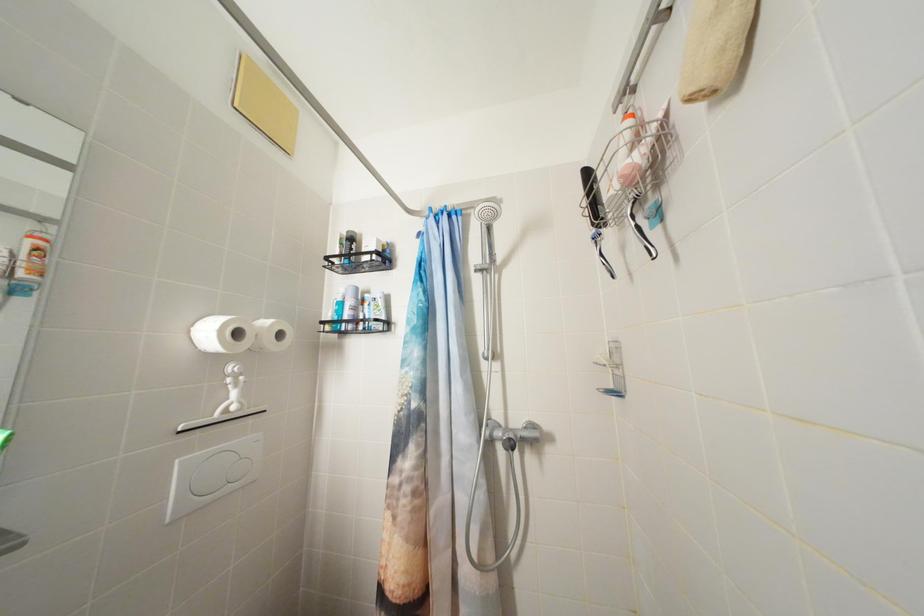
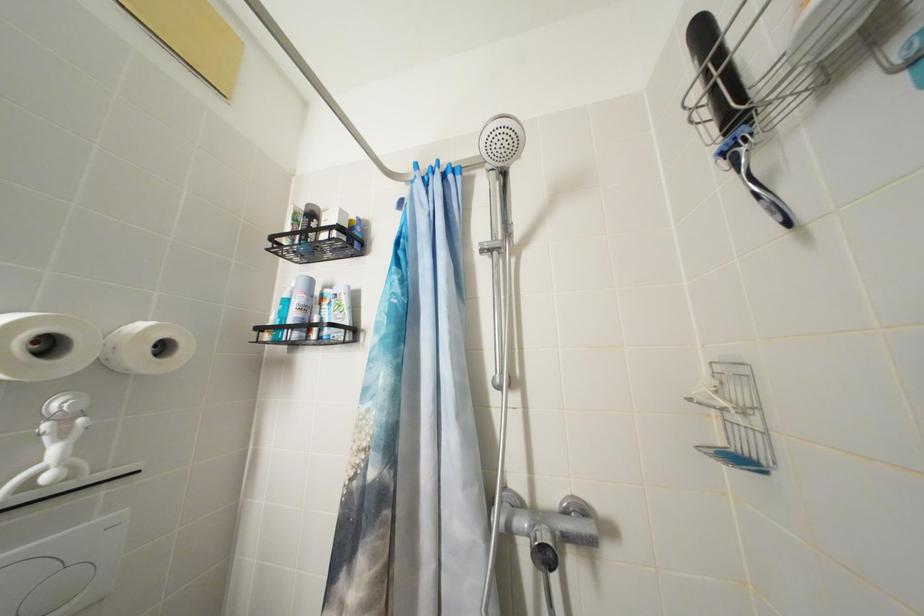
Question: Based on the continuous images, in which direction is the camera rotating? Reply with the corresponding letter.

Choices:
 (A) Left
 (B) Right
 (C) Up
 (D) Down

Answer: (C)